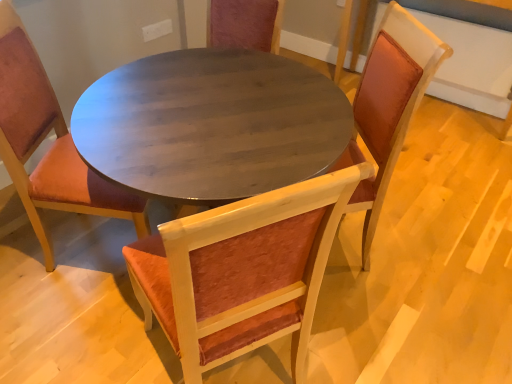
Where is `vacant area situated to the left side of velvet orange chair at center, which is the second chair from left to right`? This screenshot has width=512, height=384. vacant area situated to the left side of velvet orange chair at center, which is the second chair from left to right is located at coordinates (87, 342).